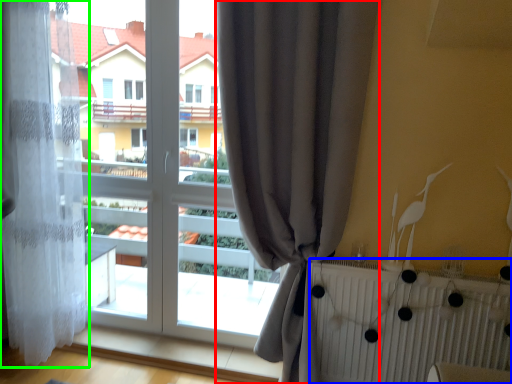
Question: Considering the real-world distances, which object is closest to curtain (highlighted by a red box)? radiator (highlighted by a blue box) or curtain (highlighted by a green box).

Choices:
 (A) radiator
 (B) curtain

Answer: (A)